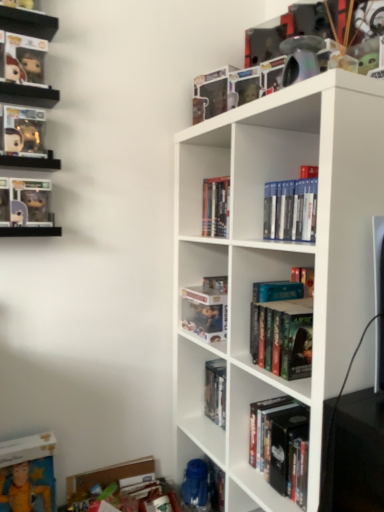
In order to face matte gold figurine at upper left, which is counted as the eighth book, starting from the right, should I rotate leftwards or rightwards?

To align with it, rotate left about 21.698°.

The height and width of the screenshot is (512, 384). Describe the element at coordinates (215, 391) in the screenshot. I see `hardcover book at center, the fifth book from the left` at that location.

Find the location of a particular element. The height and width of the screenshot is (512, 384). matte black figurine at upper left, placed as the seventh book when sorted from right to left is located at coordinates (27, 201).

Is hardcover books at center, the 6th book from the left, to the right of matte black figurine at upper left, the second book viewed from the left, from the viewer's perspective?

Yes, hardcover books at center, the 6th book from the left, is to the right of matte black figurine at upper left, the second book viewed from the left.

Consider the image. Is hardcover books at center, the 6th book from the left, far away from matte black figurine at upper left, the second book viewed from the left?

hardcover books at center, the 6th book from the left, is actually quite close to matte black figurine at upper left, the second book viewed from the left.

From the picture: Considering the sizes of objects hardcover books at center, the 6th book from the left, and matte black figurine at upper left, the second book viewed from the left, in the image provided, who is thinner, hardcover books at center, the 6th book from the left, or matte black figurine at upper left, the second book viewed from the left,?

hardcover books at center, the 6th book from the left, is thinner.

Does hardcover books at center, placed as the third book when sorted from right to left, turn towards matte black figurine at upper left, the second book viewed from the left?

No, hardcover books at center, placed as the third book when sorted from right to left, is not turned towards matte black figurine at upper left, the second book viewed from the left.

Which point is more distant from viewer, (283, 462) or (192, 501)?

Positioned behind is point (192, 501).

Can blue plastic water bottle at lower center be found inside black matte book at lower right, which ranks as the eighth book in left-to-right order?

No, blue plastic water bottle at lower center is located outside of black matte book at lower right, which ranks as the eighth book in left-to-right order.

Looking at this image, from a real-world perspective, is black matte book at lower right, acting as the 1th book starting from the right, positioned above or below blue plastic water bottle at lower center?

From a real-world perspective, black matte book at lower right, acting as the 1th book starting from the right, is physically above blue plastic water bottle at lower center.

You are a GUI agent. You are given a task and a screenshot of the screen. Output one action in this format:
    pyautogui.click(x=<x>, y=<y>)
    Task: Click on the cabinet that is on the left side of black matte book at lower right, acting as the 1th book starting from the right
    The width and height of the screenshot is (384, 512).
    Given the screenshot: What is the action you would take?
    pyautogui.click(x=204, y=484)

Between metallic rainbow pipe at upper right and matte gold figurine at upper left, which is counted as the eighth book, starting from the right, which one has larger width?

matte gold figurine at upper left, which is counted as the eighth book, starting from the right, is wider.

Locate an element on the screen. toy on the right of matte gold figurine at upper left, which is counted as the eighth book, starting from the right is located at coordinates (300, 58).

Is the surface of metallic rainbow pipe at upper right in direct contact with matte gold figurine at upper left, placed as the 1th book when sorted from left to right?

No, metallic rainbow pipe at upper right is not beside matte gold figurine at upper left, placed as the 1th book when sorted from left to right.

Could you tell me if metallic rainbow pipe at upper right is turned towards matte gold figurine at upper left, placed as the 1th book when sorted from left to right?

No, metallic rainbow pipe at upper right is not oriented towards matte gold figurine at upper left, placed as the 1th book when sorted from left to right.

This screenshot has width=384, height=512. I want to click on shelf that is on the right side of black matte book at lower right, which ranks as the eighth book in left-to-right order, so click(x=277, y=259).

Is black matte book at lower right, acting as the 1th book starting from the right, positioned with its back to white matte bookshelf at center, which is the first shelf from bottom to top?

Yes, black matte book at lower right, acting as the 1th book starting from the right, is facing away from white matte bookshelf at center, which is the first shelf from bottom to top.

From their relative heights in the image, would you say black matte book at lower right, acting as the 1th book starting from the right, is taller or shorter than white matte bookshelf at center, which ranks as the second shelf in top-to-bottom order?

black matte book at lower right, acting as the 1th book starting from the right, is shorter than white matte bookshelf at center, which ranks as the second shelf in top-to-bottom order.

Is hardcover book at center, which ranks as the seventh book in left-to-right order, at the back of black matte book at lower right, which ranks as the eighth book in left-to-right order?

That's not correct — black matte book at lower right, which ranks as the eighth book in left-to-right order, is not looking away from hardcover book at center, which ranks as the seventh book in left-to-right order.

From a real-world perspective, who is located lower, black matte book at lower right, which ranks as the eighth book in left-to-right order, or hardcover book at center, which ranks as the seventh book in left-to-right order?

black matte book at lower right, which ranks as the eighth book in left-to-right order.

Is point (282, 495) closer to viewer compared to point (256, 307)?

Yes, it is.

Is point (214, 326) behind point (303, 58)?

Yes, point (214, 326) is behind point (303, 58).

From the image's perspective, which is above, translucent plastic figure at upper center, the sixth book viewed from the right, or metallic rainbow pipe at upper right?

metallic rainbow pipe at upper right appears higher in the image.

Which of these two, translucent plastic figure at upper center, placed as the third book when sorted from left to right, or metallic rainbow pipe at upper right, is thinner?

translucent plastic figure at upper center, placed as the third book when sorted from left to right.

Is the depth of translucent plastic figure at upper center, placed as the third book when sorted from left to right, less than that of metallic rainbow pipe at upper right?

No, the depth of translucent plastic figure at upper center, placed as the third book when sorted from left to right, is greater than that of metallic rainbow pipe at upper right.

Is translucent plastic figure at upper center, the sixth book viewed from the right, with black matte book at lower right, which ranks as the eighth book in left-to-right order?

There is a gap between translucent plastic figure at upper center, the sixth book viewed from the right, and black matte book at lower right, which ranks as the eighth book in left-to-right order.

In terms of height, does translucent plastic figure at upper center, the sixth book viewed from the right, look taller or shorter compared to black matte book at lower right, which ranks as the eighth book in left-to-right order?

Clearly, translucent plastic figure at upper center, the sixth book viewed from the right, is shorter compared to black matte book at lower right, which ranks as the eighth book in left-to-right order.

Is translucent plastic figure at upper center, placed as the third book when sorted from left to right, turned away from black matte book at lower right, which ranks as the eighth book in left-to-right order?

translucent plastic figure at upper center, placed as the third book when sorted from left to right, does not have its back to black matte book at lower right, which ranks as the eighth book in left-to-right order.

Considering the sizes of objects translucent plastic figure at upper center, placed as the third book when sorted from left to right, and black matte book at lower right, acting as the 1th book starting from the right, in the image provided, who is smaller, translucent plastic figure at upper center, placed as the third book when sorted from left to right, or black matte book at lower right, acting as the 1th book starting from the right,?

translucent plastic figure at upper center, placed as the third book when sorted from left to right.

Locate an element on the screen. This screenshot has width=384, height=512. the 1st book above when counting from the hardcover books at center, placed as the third book when sorted from right to left (from the image's perspective) is located at coordinates (27, 201).

At what (x,y) coordinates should I click in order to perform the action: click on cabinet below the black matte book at lower right, which ranks as the eighth book in left-to-right order (from the image's perspective). Please return your answer as a coordinate pair (x, y). Looking at the image, I should click on (204, 484).

From the picture: Which object lies further to the anchor point matte gold figurine at upper left, placed as the 1th book when sorted from left to right, white matte bookshelf at center, arranged as the first shelf when viewed from the right, or hardcover book at center, which is the fourth book from right to left?

The object further to matte gold figurine at upper left, placed as the 1th book when sorted from left to right, is hardcover book at center, which is the fourth book from right to left.

Based on their spatial positions, is hardcover book at center, which is the fourth book from right to left, or black matte book at lower right, which ranks as the eighth book in left-to-right order, further from hardcover books at center, the fifth book viewed from the right?

black matte book at lower right, which ranks as the eighth book in left-to-right order, lies further to hardcover books at center, the fifth book viewed from the right, than the other object.

From the image, which object appears to be nearer to hardcover book at center, positioned as the second book in right-to-left order, black matte book at lower right, acting as the 1th book starting from the right, or hardcover books at center, the fifth book viewed from the right?

The object closer to hardcover book at center, positioned as the second book in right-to-left order, is black matte book at lower right, acting as the 1th book starting from the right.

Considering their positions, is blue plastic water bottle at lower center positioned further to hardcover books at center, the 6th book from the left, than hardcover books at center, the 4th book positioned from the left?

blue plastic water bottle at lower center is positioned further to the anchor hardcover books at center, the 6th book from the left.

When comparing their distances from white matte bookshelf at center, which appears as the first shelf when viewed from the front, does blue plastic water bottle at lower center or metallic rainbow pipe at upper right seem further?

blue plastic water bottle at lower center.

Considering their positions, is matte black figurine at upper left, the second book viewed from the left, positioned closer to translucent plastic figure at upper center, the sixth book viewed from the right, than matte gold figurine at upper left, placed as the 1th book when sorted from left to right?

Based on the image, matte black figurine at upper left, the second book viewed from the left, appears to be nearer to translucent plastic figure at upper center, the sixth book viewed from the right.

When comparing their distances from matte gold figurine at upper left, which is counted as the eighth book, starting from the right, does blue plastic water bottle at lower center or hardcover books at center, the 6th book from the left, seem further?

blue plastic water bottle at lower center is further to matte gold figurine at upper left, which is counted as the eighth book, starting from the right.

Consider the image. Estimate the real-world distances between objects in this image. Which object is closer to metallic rainbow pipe at upper right, white matte bookshelf at center, which is the first shelf from bottom to top, or matte gold figurine at upper left, placed as the 1th book when sorted from left to right?

white matte bookshelf at center, which is the first shelf from bottom to top, lies closer to metallic rainbow pipe at upper right than the other object.

The image size is (384, 512). I want to click on toy between clear plastic figurines at upper left, positioned as the 2th shelf in right-to-left order, and white matte bookshelf at center, the 2th shelf from the back, from top to bottom, so click(300, 58).

You are a GUI agent. You are given a task and a screenshot of the screen. Output one action in this format:
    pyautogui.click(x=<x>, y=<y>)
    Task: Click on the shelf between hardcover books at center, placed as the third book when sorted from right to left, and black matte book at lower right, which ranks as the eighth book in left-to-right order, vertically
    This screenshot has width=384, height=512.
    Given the screenshot: What is the action you would take?
    pyautogui.click(x=277, y=259)

You are a GUI agent. You are given a task and a screenshot of the screen. Output one action in this format:
    pyautogui.click(x=<x>, y=<y>)
    Task: Click on the shelf situated between matte gold figurine at upper left, which is counted as the eighth book, starting from the right, and hardcover books at center, the 6th book from the left, from left to right
    This screenshot has height=512, width=384.
    Given the screenshot: What is the action you would take?
    pyautogui.click(x=28, y=22)

Identify the location of shelf between hardcover books at center, the 6th book from the left, and blue plastic water bottle at lower center, in the vertical direction. (277, 259).